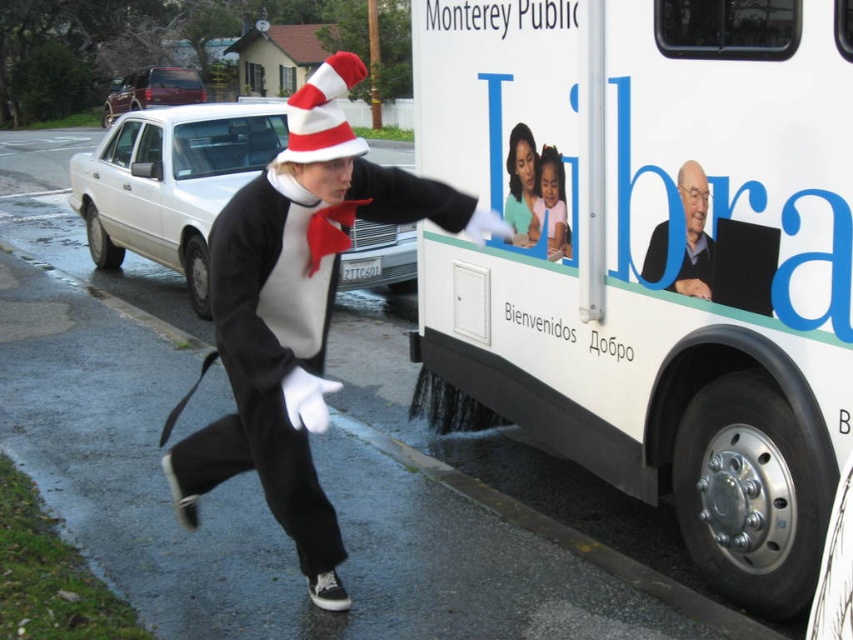
You are standing at the center of the image and want to walk towards the white matte bus at right. In which direction should you move?

The white matte bus at right is located at point (666,259), so you should move towards the right direction to reach it.

You are organizing a Dr. Seuss themed event and need to decide which costume to display first. The matte black costume at center and the pastel pink fabric at center are both available. Based on their sizes, which costume should you choose to occupy a larger space?

The matte black costume at center has a larger width than the pastel pink fabric at center, so it should be chosen to occupy a larger space.